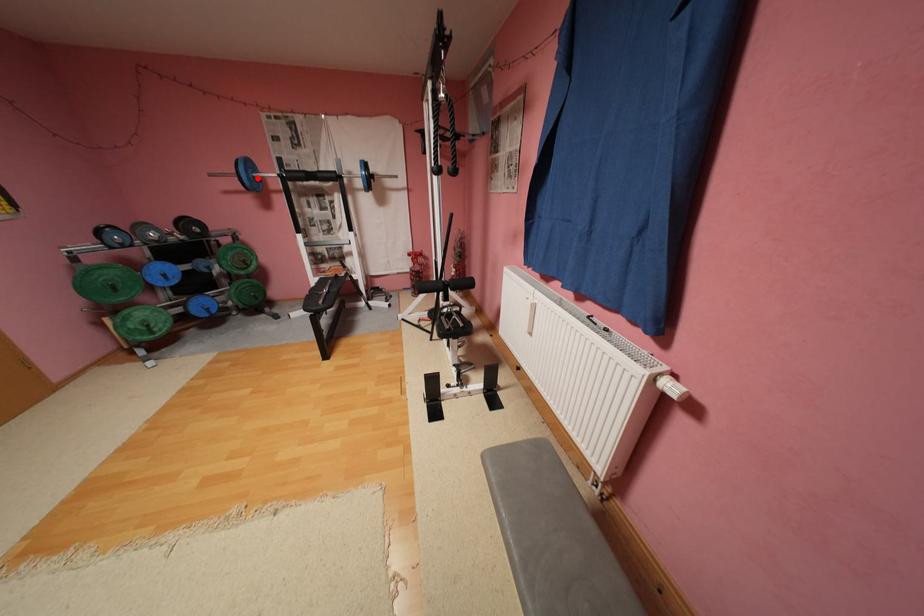
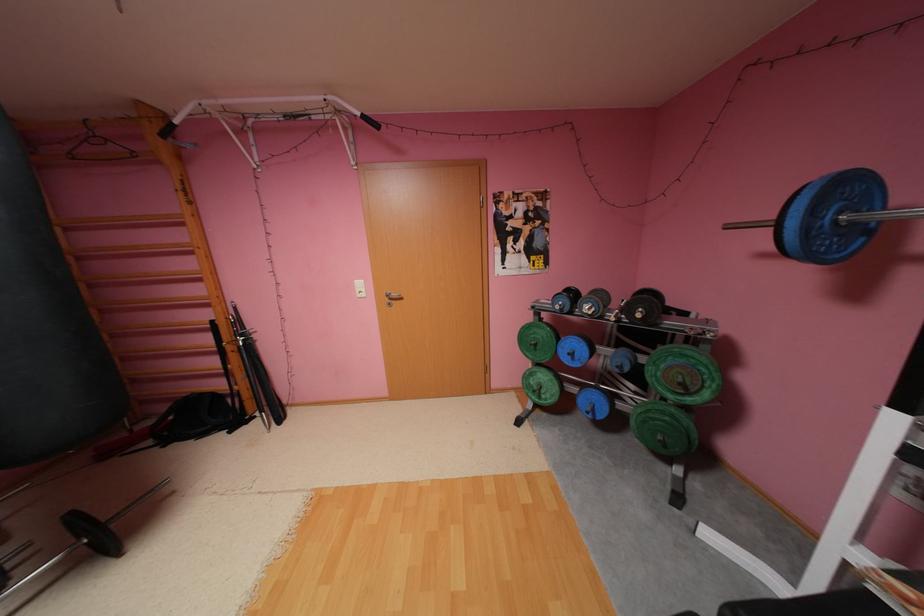
Locate, in the second image, the point that corresponds to the highlighted location in the first image.

(816, 229)